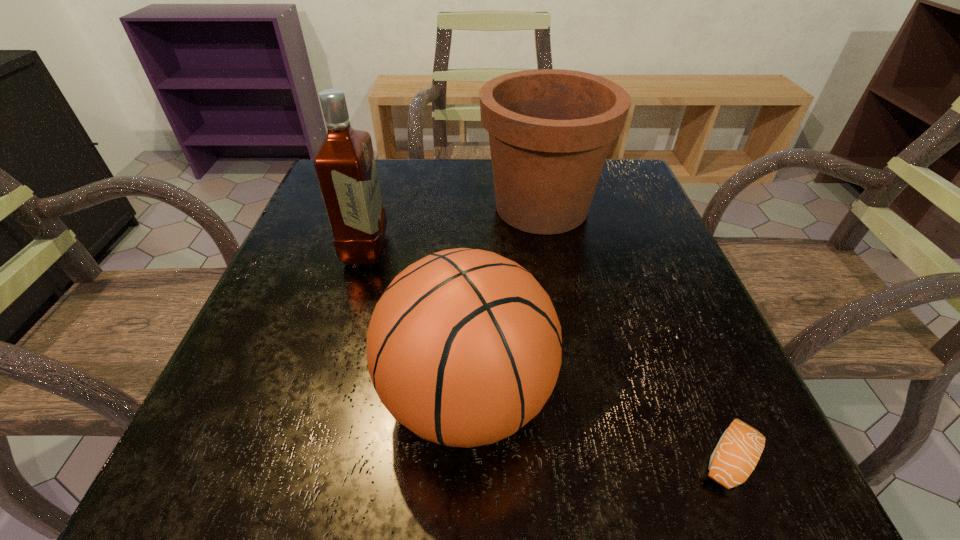
At what (x,y) coordinates should I click in order to perform the action: click on free space in the image that satisfies the following two spatial constraints: 1. on the front label of the liquor; 2. on the left side of the rightmost object. Please return your answer as a coordinate pair (x, y). Looking at the image, I should click on (303, 458).

Identify the location of vacant space that satisfies the following two spatial constraints: 1. on the back side of the basketball; 2. on the front label of the liquor. (470, 249).

Image resolution: width=960 pixels, height=540 pixels. I want to click on blank space that satisfies the following two spatial constraints: 1. on the front label of the basketball; 2. on the left side of the liquor, so click(322, 397).

Identify the location of free location that satisfies the following two spatial constraints: 1. on the front side of the flowerpot; 2. on the front label of the liquor. This screenshot has height=540, width=960. (549, 249).

Identify the location of free location that satisfies the following two spatial constraints: 1. on the front label of the liquor; 2. on the right side of the rightmost object. (303, 458).

You are a GUI agent. You are given a task and a screenshot of the screen. Output one action in this format:
    pyautogui.click(x=<x>, y=<y>)
    Task: Click on the vacant position in the image that satisfies the following two spatial constraints: 1. on the front label of the leftmost object; 2. on the back side of the rightmost object
    Image resolution: width=960 pixels, height=540 pixels.
    Given the screenshot: What is the action you would take?
    tap(303, 458)

The width and height of the screenshot is (960, 540). I want to click on vacant space that satisfies the following two spatial constraints: 1. on the front label of the leftmost object; 2. on the back side of the rightmost object, so click(x=303, y=458).